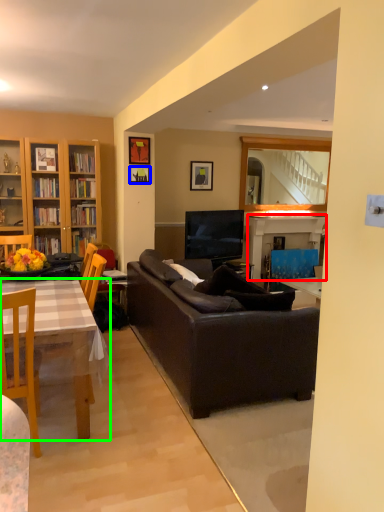
Question: Based on their relative distances, which object is nearer to fireplace (highlighted by a red box)? Choose from picture frame (highlighted by a blue box) and desk (highlighted by a green box).

Choices:
 (A) picture frame
 (B) desk

Answer: (A)